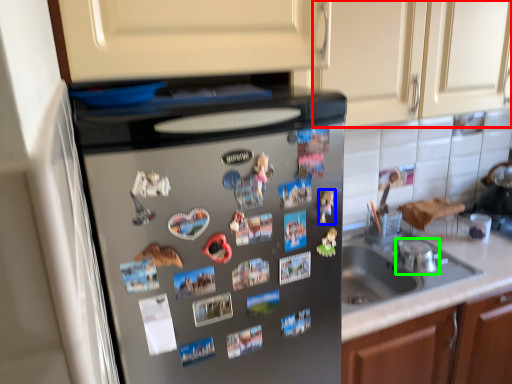
Question: Which object is the closest to the cabinetry (highlighted by a red box)? Choose among these: toy (highlighted by a blue box) or appliance (highlighted by a green box).

Choices:
 (A) toy
 (B) appliance

Answer: (B)